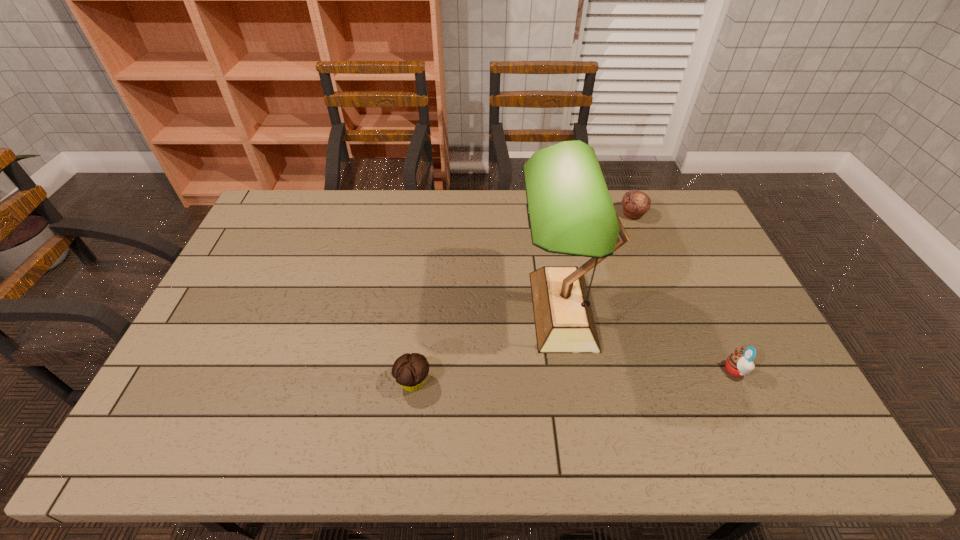
Locate an element on the screen. free space between the table lamp and the rightmost muffin is located at coordinates (649, 340).

Find the location of a particular element. The image size is (960, 540). free space between the rightmost muffin and the farthest muffin is located at coordinates (684, 292).

Find the location of `empty location between the leftmost object and the tallest object`. empty location between the leftmost object and the tallest object is located at coordinates (488, 346).

This screenshot has height=540, width=960. Find the location of `unoccupied position between the rightmost object and the leftmost object`. unoccupied position between the rightmost object and the leftmost object is located at coordinates (574, 376).

Identify the location of vacant space that's between the farthest muffin and the leftmost muffin. This screenshot has width=960, height=540. (523, 298).

You are a GUI agent. You are given a task and a screenshot of the screen. Output one action in this format:
    pyautogui.click(x=<x>, y=<y>)
    Task: Click on the vacant point located between the second muffin from right to left and the leftmost muffin
    
    Given the screenshot: What is the action you would take?
    pyautogui.click(x=523, y=298)

Identify the location of free space between the leftmost object and the rightmost object. The width and height of the screenshot is (960, 540). (574, 376).

Where is `free space between the rightmost object and the third object from left to right`? free space between the rightmost object and the third object from left to right is located at coordinates (684, 292).

Select which object is the closest to the rightmost object. Please provide its 2D coordinates. Your answer should be formatted as a tuple, i.e. [(x, y)], where the tuple contains the x and y coordinates of a point satisfying the conditions above.

[(570, 210)]

Point out which object is positioned as the nearest to the third object from right to left. Please provide its 2D coordinates. Your answer should be formatted as a tuple, i.e. [(x, y)], where the tuple contains the x and y coordinates of a point satisfying the conditions above.

[(410, 370)]